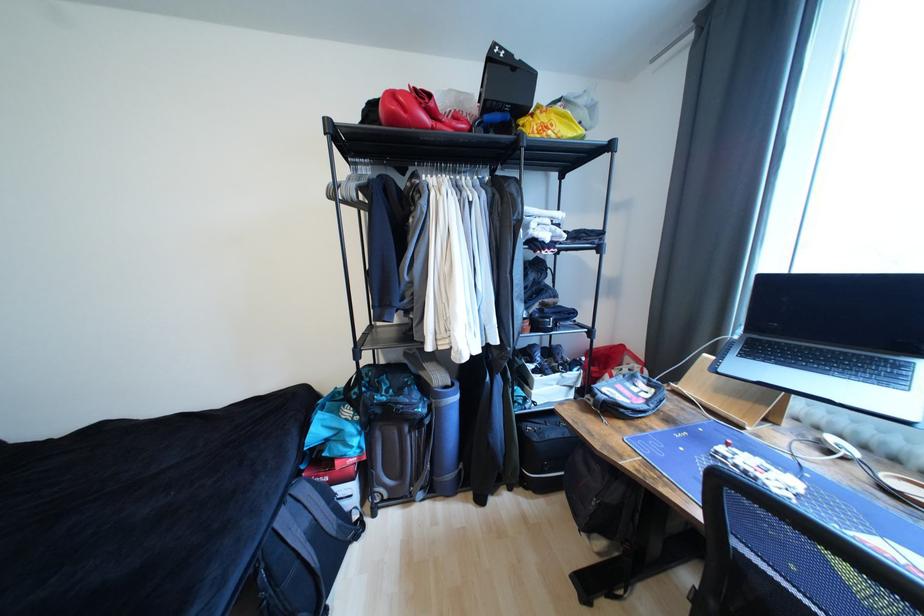
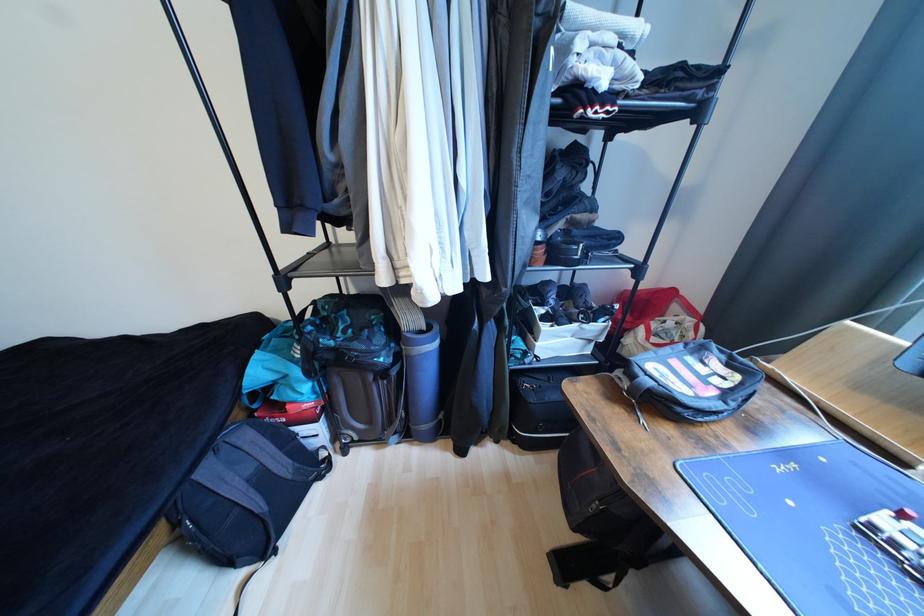
The point at (x=289, y=520) is marked in the first image. Where is the corresponding point in the second image?

(215, 472)